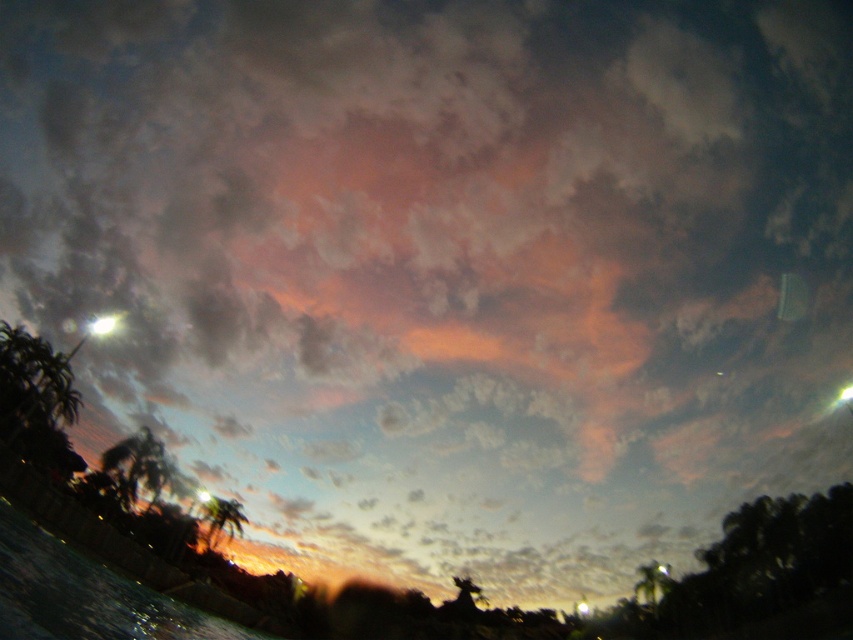
Consider the image. Does green leafy palm tree at lower left have a larger size compared to green leafy palm tree at lower center?

Yes.

Who is more distant from viewer, (x=112, y=468) or (x=216, y=516)?

The point (x=216, y=516) is behind.

Where is `green leafy palm tree at lower left`? This screenshot has width=853, height=640. green leafy palm tree at lower left is located at coordinates (137, 465).

Image resolution: width=853 pixels, height=640 pixels. Identify the location of translucent water at lower left. (85, 595).

Looking at this image, which is below, translucent water at lower left or green leafy palm tree at lower left?

translucent water at lower left is below.

The height and width of the screenshot is (640, 853). What are the coordinates of `translucent water at lower left` in the screenshot? It's located at (85, 595).

Where is `translucent water at lower left`? The height and width of the screenshot is (640, 853). translucent water at lower left is located at coordinates (85, 595).

Measure the distance from translucent water at lower left to green leafy palm tree at lower center.

A distance of 28.68 meters exists between translucent water at lower left and green leafy palm tree at lower center.

Who is shorter, translucent water at lower left or green leafy palm tree at lower center?

With less height is green leafy palm tree at lower center.

Between point (4, 544) and point (207, 520), which one is positioned behind?

The point (207, 520) is more distant.

Where is `translucent water at lower left`? Image resolution: width=853 pixels, height=640 pixels. translucent water at lower left is located at coordinates (85, 595).